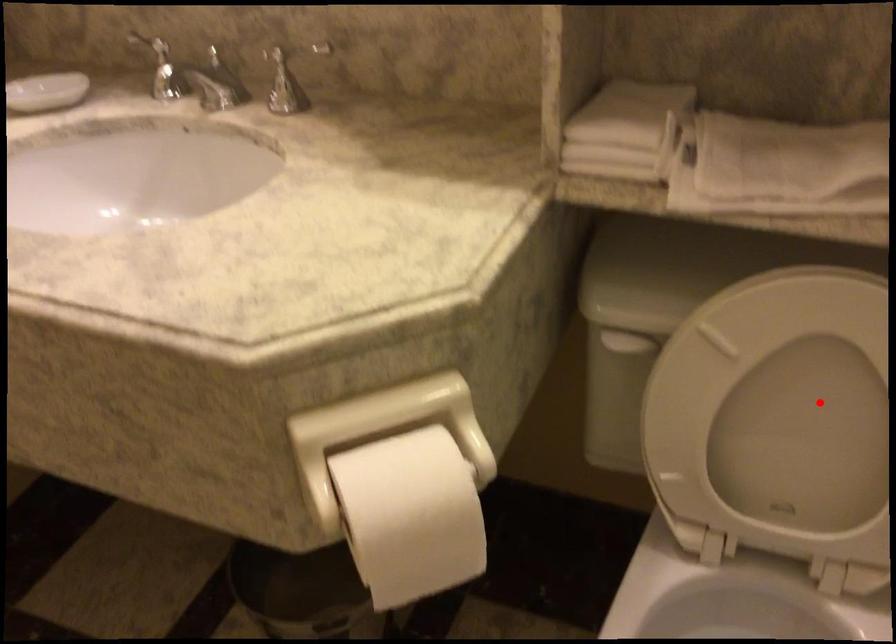
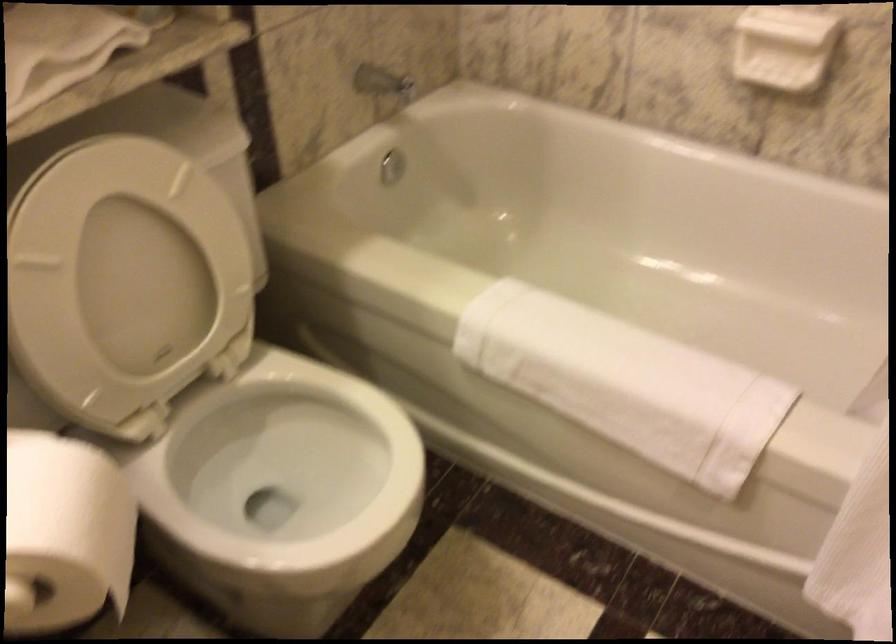
Question: I am providing you with two images of the same scene from different viewpoints. A red point is shown in image1. For the corresponding object point in image2, is it positioned nearer or farther from the camera?

Choices:
 (A) Nearer
 (B) Farther

Answer: (B)